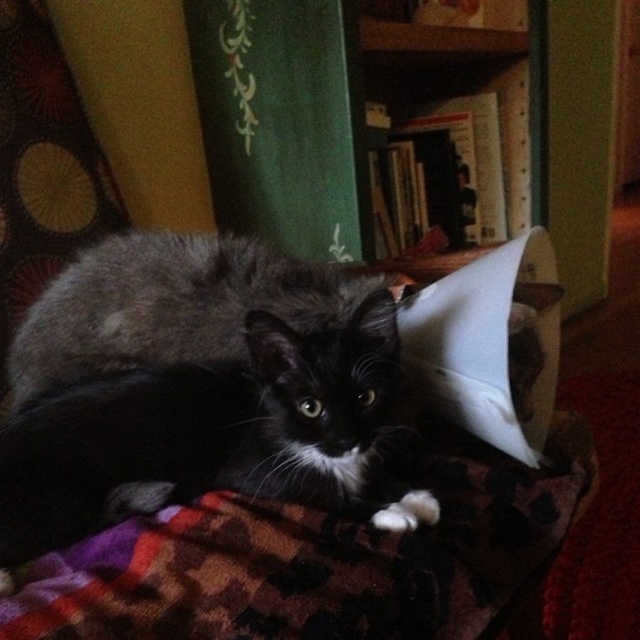
Between black fur cat at center and fluffy black cat at center, which one is positioned lower?

black fur cat at center

At what (x,y) coordinates should I click in order to perform the action: click on black fur cat at center. Please return your answer as a coordinate pair (x, y). Looking at the image, I should click on (204, 432).

Find the location of a particular element. The width and height of the screenshot is (640, 640). black fur cat at center is located at coordinates (204, 432).

At what (x,y) coordinates should I click in order to perform the action: click on black fur cat at center. Please return your answer as a coordinate pair (x, y). Looking at the image, I should click on (204, 432).